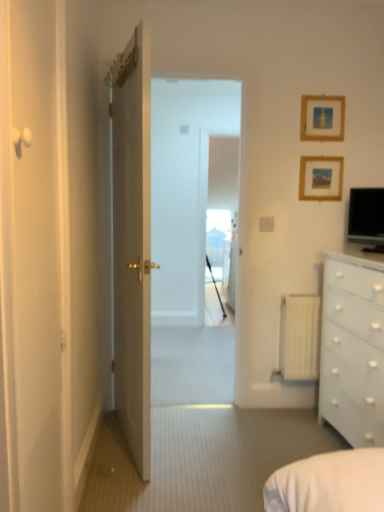
This screenshot has height=512, width=384. Find the location of `vacant area that is situated to the right of white glossy door at center, acting as the 1th door starting from the back`. vacant area that is situated to the right of white glossy door at center, acting as the 1th door starting from the back is located at coordinates (216, 446).